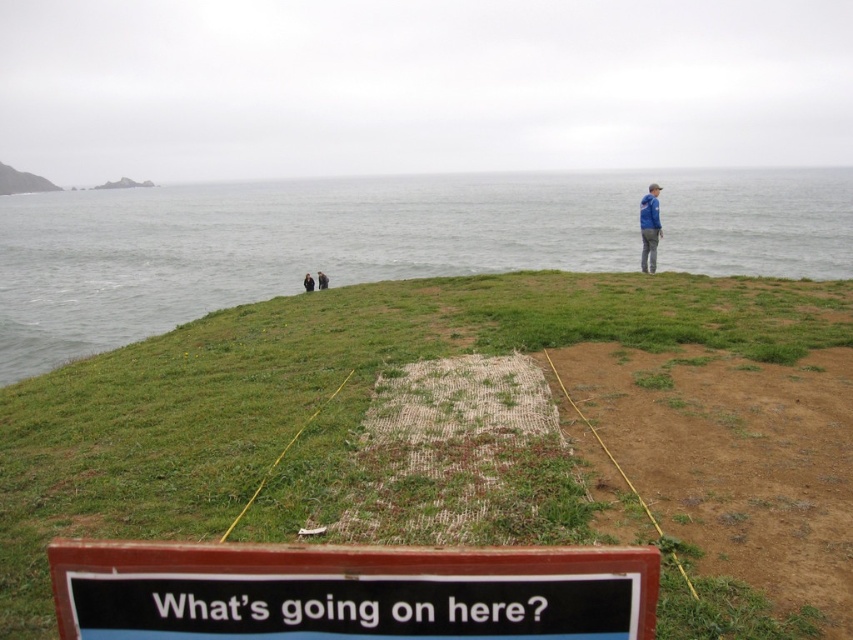
Question: Which of the following is the farthest from the observer?

Choices:
 (A) green grassy at center
 (B) black fabric person at lower left

Answer: (B)

Question: Can you confirm if green grassy at center is positioned above black plastic sign at lower center?

Choices:
 (A) yes
 (B) no

Answer: (A)

Question: Among these points, which one is farthest from the camera?

Choices:
 (A) (334, 577)
 (B) (273, 401)
 (C) (321, 288)

Answer: (C)

Question: Considering the relative positions of gray water at center and blue fabric jacket at upper right in the image provided, where is gray water at center located with respect to blue fabric jacket at upper right?

Choices:
 (A) left
 (B) right

Answer: (B)

Question: Is blue fabric jacket at upper right below black fabric person at lower left?

Choices:
 (A) no
 (B) yes

Answer: (A)

Question: Which of the following is the farthest from the observer?

Choices:
 (A) black fabric person at lower left
 (B) gray water at center
 (C) dark blue jacket at center
 (D) green grassy at center

Answer: (A)